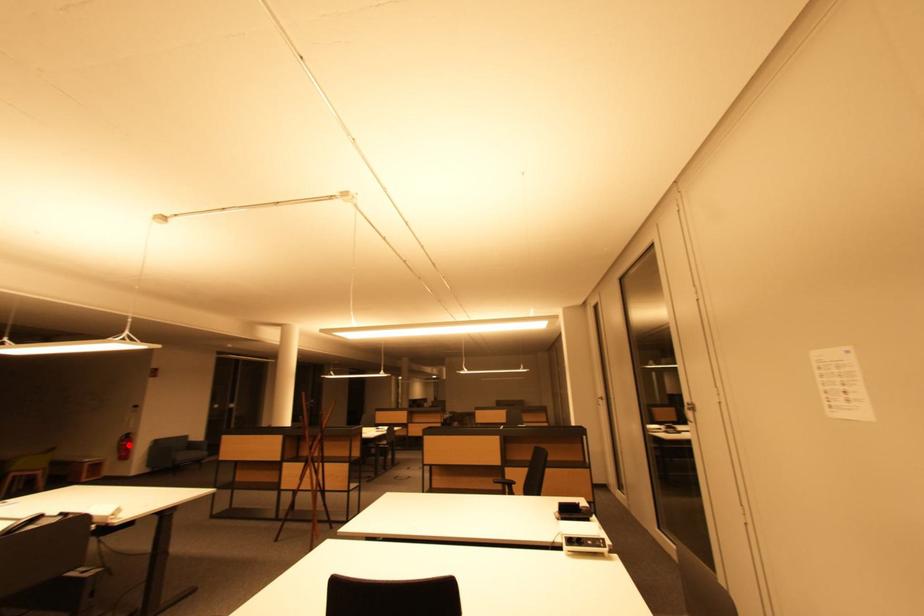
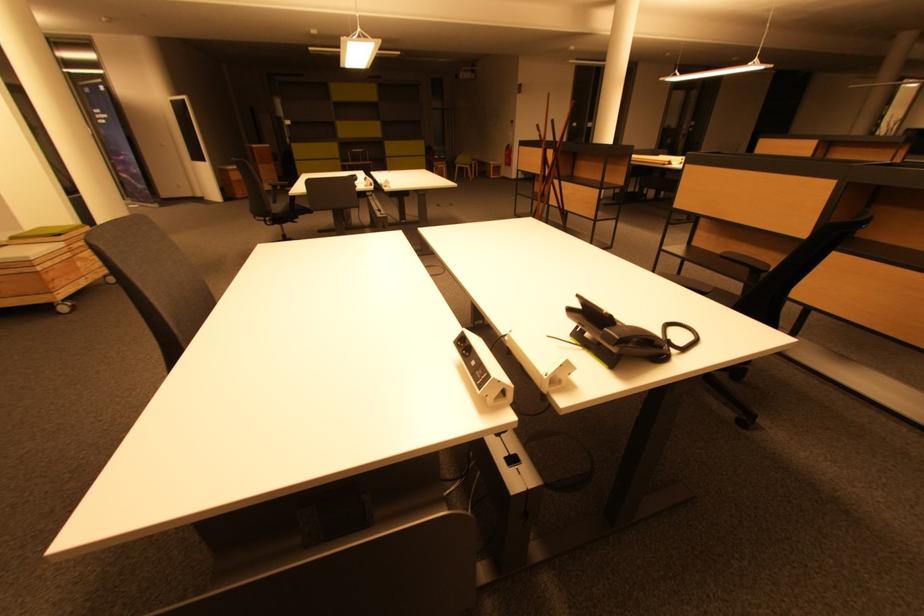
Question: I am providing you with two images of the same scene from different viewpoints. Given a red point in image1, look at the same physical point in image2. Is it:

Choices:
 (A) Closer to the viewpoint
 (B) Farther from the viewpoint

Answer: (A)